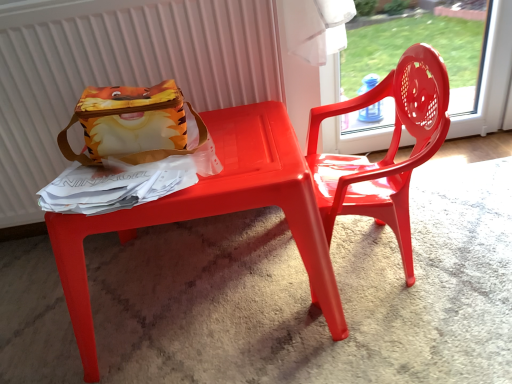
This screenshot has height=384, width=512. What are the coordinates of `matte plastic radiator at upper left` in the screenshot? It's located at (119, 71).

The height and width of the screenshot is (384, 512). In order to click on glossy plastic chair at right in this screenshot , I will do `click(387, 151)`.

What do you see at coordinates (387, 151) in the screenshot? This screenshot has height=384, width=512. I see `glossy plastic chair at right` at bounding box center [387, 151].

At what (x,y) coordinates should I click in order to perform the action: click on matte fabric lunchbox at upper left. Please return your answer as a coordinate pair (x, y). The width and height of the screenshot is (512, 384). Looking at the image, I should click on (133, 124).

This screenshot has width=512, height=384. What do you see at coordinates (214, 212) in the screenshot?
I see `matte plastic table at center` at bounding box center [214, 212].

Locate an element on the screen. Image resolution: width=512 pixels, height=384 pixels. matte plastic radiator at upper left is located at coordinates (119, 71).

Would you say matte plastic radiator at upper left is part of glossy plastic chair at right's contents?

No, matte plastic radiator at upper left is not inside glossy plastic chair at right.

Are glossy plastic chair at right and matte plastic radiator at upper left beside each other?

glossy plastic chair at right is not next to matte plastic radiator at upper left, and they're not touching.

From the image's perspective, who appears lower, glossy plastic chair at right or matte plastic radiator at upper left?

glossy plastic chair at right.

Considering the positions of point (393, 147) and point (12, 171), is point (393, 147) closer or farther from the camera than point (12, 171)?

Clearly, point (393, 147) is closer to the camera than point (12, 171).

Based on their sizes in the image, would you say matte fabric lunchbox at upper left is bigger or smaller than glossy plastic chair at right?

→ matte fabric lunchbox at upper left is smaller than glossy plastic chair at right.

Choose the correct answer: Is matte fabric lunchbox at upper left inside glossy plastic chair at right or outside it?

The correct answer is: outside.

Is point (84, 136) behind point (429, 87)?

Yes, point (84, 136) is behind point (429, 87).

Are matte fabric lunchbox at upper left and glossy plastic chair at right beside each other?

No, matte fabric lunchbox at upper left is not in contact with glossy plastic chair at right.

From the image's perspective, is matte plastic table at center under matte plastic radiator at upper left?

Yes, from the image's perspective, matte plastic table at center is below matte plastic radiator at upper left.

From their relative heights in the image, would you say matte plastic table at center is taller or shorter than matte plastic radiator at upper left?

Considering their sizes, matte plastic table at center has less height than matte plastic radiator at upper left.

Does matte plastic table at center touch matte fabric lunchbox at upper left?

matte plastic table at center and matte fabric lunchbox at upper left are not in contact.

Consider the image. Is matte plastic table at center bigger than matte fabric lunchbox at upper left?

Correct, matte plastic table at center is larger in size than matte fabric lunchbox at upper left.

Between glossy plastic chair at right and matte fabric lunchbox at upper left, which one is positioned in front?

Positioned in front is glossy plastic chair at right.

Is matte fabric lunchbox at upper left at the back of glossy plastic chair at right?

No, glossy plastic chair at right is not facing away from matte fabric lunchbox at upper left.

From the image's perspective, is glossy plastic chair at right below matte fabric lunchbox at upper left?

Correct, glossy plastic chair at right appears lower than matte fabric lunchbox at upper left in the image.

Would you consider glossy plastic chair at right to be distant from matte fabric lunchbox at upper left?

glossy plastic chair at right is near matte fabric lunchbox at upper left, not far away.

Does matte fabric lunchbox at upper left have a smaller size compared to matte plastic table at center?

Correct, matte fabric lunchbox at upper left occupies less space than matte plastic table at center.

From the image's perspective, who appears lower, matte fabric lunchbox at upper left or matte plastic table at center?

From the image's view, matte plastic table at center is below.

From a real-world perspective, is matte fabric lunchbox at upper left beneath matte plastic table at center?

Actually, matte fabric lunchbox at upper left is physically above matte plastic table at center in the real world.

Which object is positioned more to the left, matte fabric lunchbox at upper left or matte plastic table at center?

From the viewer's perspective, matte fabric lunchbox at upper left appears more on the left side.

Considering the sizes of objects matte plastic radiator at upper left and matte fabric lunchbox at upper left in the image provided, who is bigger, matte plastic radiator at upper left or matte fabric lunchbox at upper left?

Bigger between the two is matte plastic radiator at upper left.

Can you confirm if matte plastic radiator at upper left is taller than matte fabric lunchbox at upper left?

Yes.

From the image's perspective, is matte plastic radiator at upper left positioned above or below matte fabric lunchbox at upper left?

From the image's perspective, matte plastic radiator at upper left appears above matte fabric lunchbox at upper left.

Is matte plastic radiator at upper left oriented towards matte fabric lunchbox at upper left?

Yes, matte plastic radiator at upper left is oriented towards matte fabric lunchbox at upper left.

You are a GUI agent. You are given a task and a screenshot of the screen. Output one action in this format:
    pyautogui.click(x=<x>, y=<y>)
    Task: Click on the radiator located behind the glossy plastic chair at right
    This screenshot has height=384, width=512.
    Given the screenshot: What is the action you would take?
    pyautogui.click(x=119, y=71)

You are a GUI agent. You are given a task and a screenshot of the screen. Output one action in this format:
    pyautogui.click(x=<x>, y=<y>)
    Task: Click on the chair that is on the right side of matte fabric lunchbox at upper left
    The image size is (512, 384).
    Given the screenshot: What is the action you would take?
    pyautogui.click(x=387, y=151)

Looking at the image, which one is located closer to glossy plastic chair at right, matte plastic radiator at upper left or matte plastic table at center?

matte plastic table at center lies closer to glossy plastic chair at right than the other object.

Which object lies nearer to the anchor point glossy plastic chair at right, matte plastic table at center or matte fabric lunchbox at upper left?

matte plastic table at center.

When comparing their distances from matte fabric lunchbox at upper left, does glossy plastic chair at right or matte plastic table at center seem closer?

Based on the image, matte plastic table at center appears to be nearer to matte fabric lunchbox at upper left.

Considering their positions, is matte plastic radiator at upper left positioned further to glossy plastic chair at right than matte fabric lunchbox at upper left?

matte plastic radiator at upper left is positioned further to the anchor glossy plastic chair at right.

From the picture: Estimate the real-world distances between objects in this image. Which object is further from matte plastic table at center, glossy plastic chair at right or matte fabric lunchbox at upper left?

glossy plastic chair at right.

Considering their positions, is matte fabric lunchbox at upper left positioned closer to glossy plastic chair at right than matte plastic table at center?

matte plastic table at center lies closer to glossy plastic chair at right than the other object.

Which object lies further to the anchor point matte plastic radiator at upper left, matte plastic table at center or matte fabric lunchbox at upper left?

The object further to matte plastic radiator at upper left is matte plastic table at center.

In the scene shown: When comparing their distances from glossy plastic chair at right, does matte plastic table at center or matte plastic radiator at upper left seem closer?

matte plastic table at center is closer to glossy plastic chair at right.

The height and width of the screenshot is (384, 512). What are the coordinates of `pouch located between matte plastic radiator at upper left and glossy plastic chair at right in the left-right direction` in the screenshot? It's located at (133, 124).

This screenshot has height=384, width=512. I want to click on pouch between matte plastic radiator at upper left and matte plastic table at center vertically, so click(x=133, y=124).

Where is `table between matte fabric lunchbox at upper left and glossy plastic chair at right in the horizontal direction`? table between matte fabric lunchbox at upper left and glossy plastic chair at right in the horizontal direction is located at coordinates (214, 212).

At what (x,y) coordinates should I click in order to perform the action: click on table between matte plastic radiator at upper left and glossy plastic chair at right from left to right. Please return your answer as a coordinate pair (x, y). Looking at the image, I should click on coord(214,212).